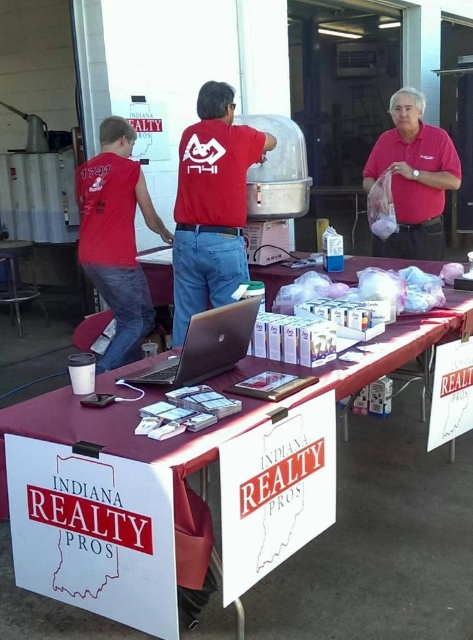
You are organizing a booth and need to place a 1.2 meter wide banner. The banner must be placed on the maroon fabric table at center or the matte red shirt at center. Based on their widths, which object can accommodate the banner?

The maroon fabric table at center has a greater width than the matte red shirt at center, so the banner should be placed on the maroon fabric table at center as it can accommodate the 1.2 meter width.

Based on the photo, you are standing at the point marked by the coordinates (211,205). Looking around, you see the matte red shirt at center. Which direction should you walk to reach the long table draped with a maroon cloth?

The point marked by the coordinates (211,205) corresponds to the matte red shirt at center. Since the long table is in front of the individuals, you should walk forward from the matte red shirt at center to reach the long table draped with a maroon cloth.

You are a photographer at the event and want to capture a photo where both the matte red shirt at center and the matte red shirt at upper right are visible. Considering their heights, which one will appear larger in the photo?

The matte red shirt at center will appear larger in the photo because it is taller than the matte red shirt at upper right according to the description.